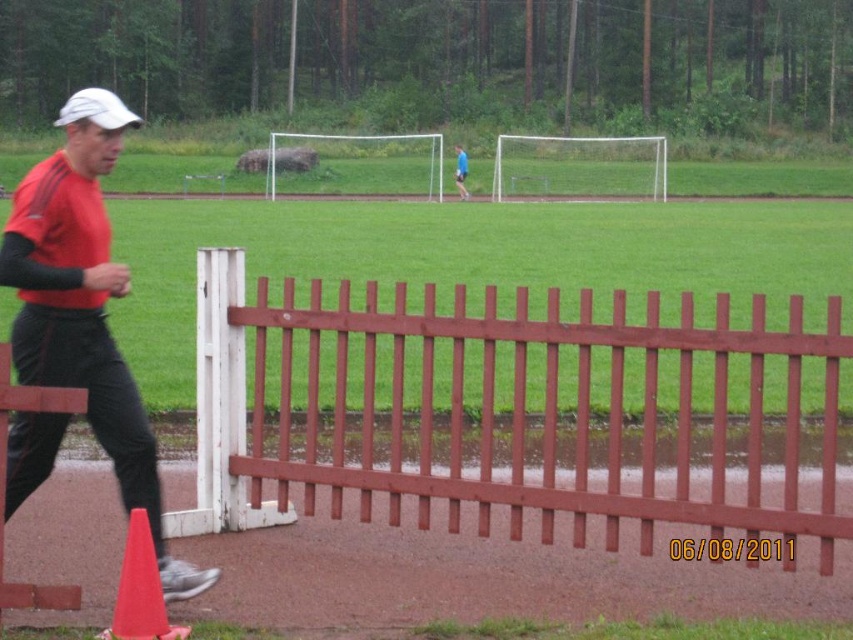
Is brown wooden fence at center above orange matte traffic cone at lower left?

Indeed, brown wooden fence at center is positioned over orange matte traffic cone at lower left.

What do you see at coordinates (526, 412) in the screenshot? I see `brown wooden fence at center` at bounding box center [526, 412].

Who is more distant from viewer, (611,547) or (128,580)?

The point (611,547) is more distant.

This screenshot has width=853, height=640. In order to click on brown wooden fence at center in this screenshot , I will do `click(526, 412)`.

Is brown wooden fence at center positioned in front of matte red shirt at left?

No, it is not.

Does point (721, 460) come closer to viewer compared to point (65, 128)?

No, it is not.

This screenshot has width=853, height=640. Describe the element at coordinates (526, 412) in the screenshot. I see `brown wooden fence at center` at that location.

Identify the location of brown wooden fence at center. The image size is (853, 640). (526, 412).

Is point (117, 372) farther from camera compared to point (148, 536)?

Yes, it is.

Who is higher up, matte red shirt at left or orange matte traffic cone at lower left?

Positioned higher is matte red shirt at left.

Locate an element on the screen. This screenshot has width=853, height=640. matte red shirt at left is located at coordinates click(x=85, y=307).

Locate an element on the screen. Image resolution: width=853 pixels, height=640 pixels. matte red shirt at left is located at coordinates (85, 307).